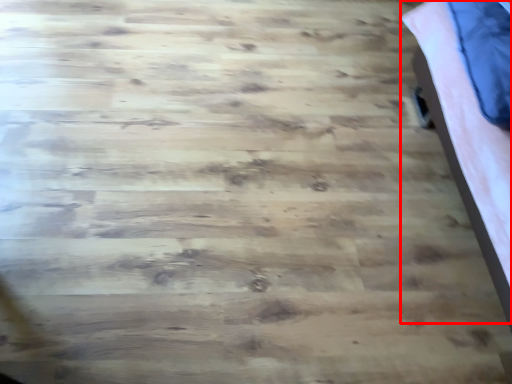
Question: From the image's perspective, what is the correct spatial relationship of bed (annotated by the red box) in relation to pillow?

Choices:
 (A) below
 (B) above

Answer: (A)